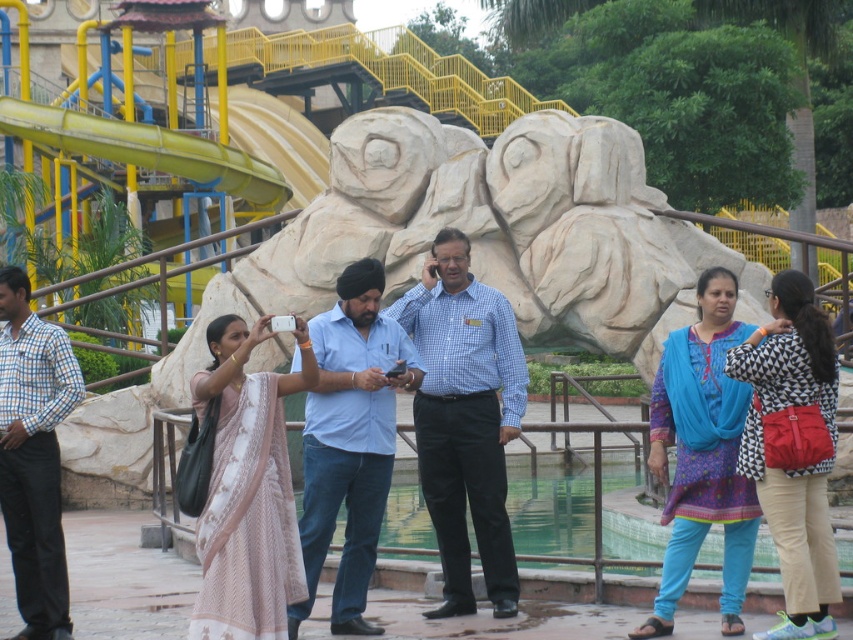
Does blue checkered shirt at center appear on the right side of blue cotton shirt at center?

Yes, blue checkered shirt at center is to the right of blue cotton shirt at center.

Does blue checkered shirt at center have a greater width compared to blue cotton shirt at center?

Yes, blue checkered shirt at center is wider than blue cotton shirt at center.

Is point (474, 404) in front of point (367, 564)?

No, it is behind (367, 564).

Find the location of a particular element. This screenshot has height=640, width=853. blue checkered shirt at center is located at coordinates (x=465, y=419).

Is the position of blue checkered shirt at left more distant than that of yellow rubber slide at upper left?

No, it is not.

Between point (7, 465) and point (173, 157), which one is positioned behind?

The point (173, 157) is behind.

Is point (6, 488) positioned in front of point (250, 170)?

That is True.

The image size is (853, 640). In order to click on blue checkered shirt at left in this screenshot , I will do `click(33, 456)`.

In the scene shown: Measure the distance between point (x=485, y=380) and camera.

Point (x=485, y=380) and camera are 163.66 feet apart.

You are a GUI agent. You are given a task and a screenshot of the screen. Output one action in this format:
    pyautogui.click(x=<x>, y=<y>)
    Task: Click on the blue checkered shirt at center
    The image size is (853, 640).
    Given the screenshot: What is the action you would take?
    pyautogui.click(x=465, y=419)